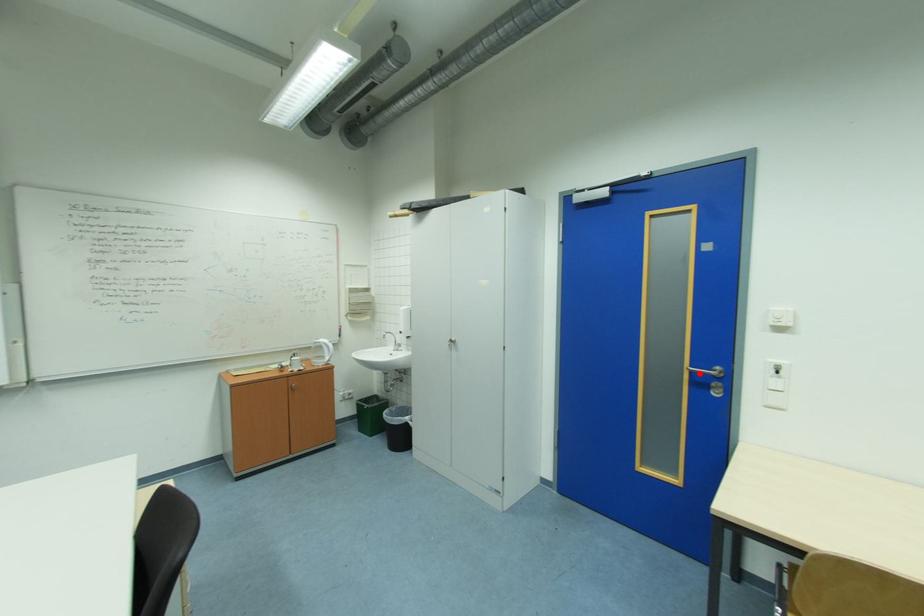
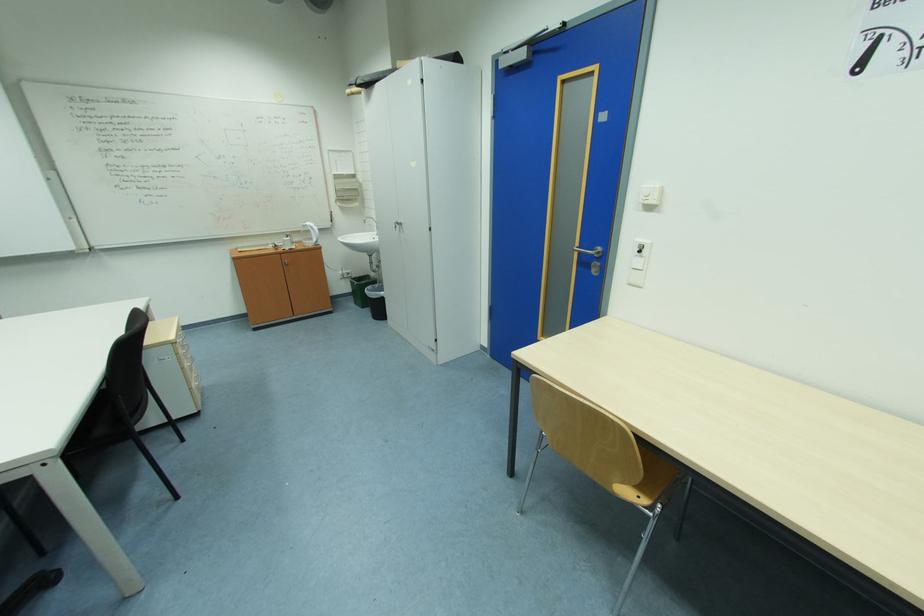
Where in the second image is the point corresponding to the highlighted location from the first image?

(587, 253)